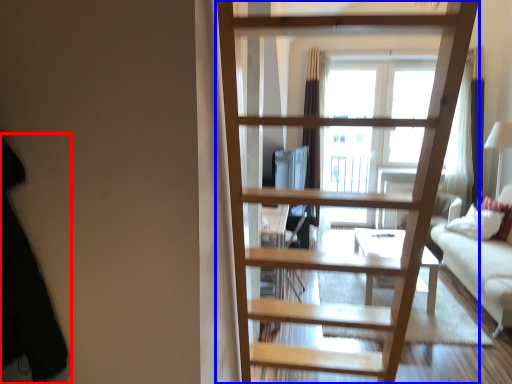
Question: Which of the following is the closest to the observer, dark (highlighted by a red box) or ladder (highlighted by a blue box)?

Choices:
 (A) dark
 (B) ladder

Answer: (A)